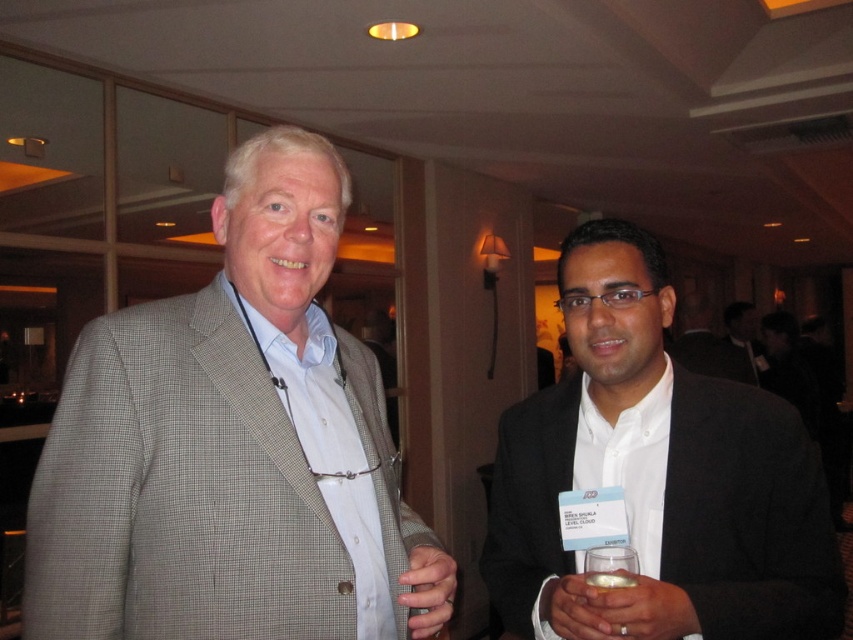
Is the position of gray checkered suit at left less distant than that of white glossy shirt at center?

That is True.

Who is lower down, gray checkered suit at left or white glossy shirt at center?

Positioned lower is white glossy shirt at center.

Locate an element on the screen. This screenshot has height=640, width=853. gray checkered suit at left is located at coordinates (225, 444).

The height and width of the screenshot is (640, 853). Describe the element at coordinates (639, 611) in the screenshot. I see `clear plastic glass at lower center` at that location.

What are the coordinates of `clear plastic glass at lower center` in the screenshot? It's located at (639, 611).

Between white shirt at center and clear glass at lower right, which one is positioned higher?

white shirt at center

Can you confirm if white shirt at center is bigger than clear glass at lower right?

Yes.

Where is `white shirt at center`? This screenshot has height=640, width=853. white shirt at center is located at coordinates (697, 339).